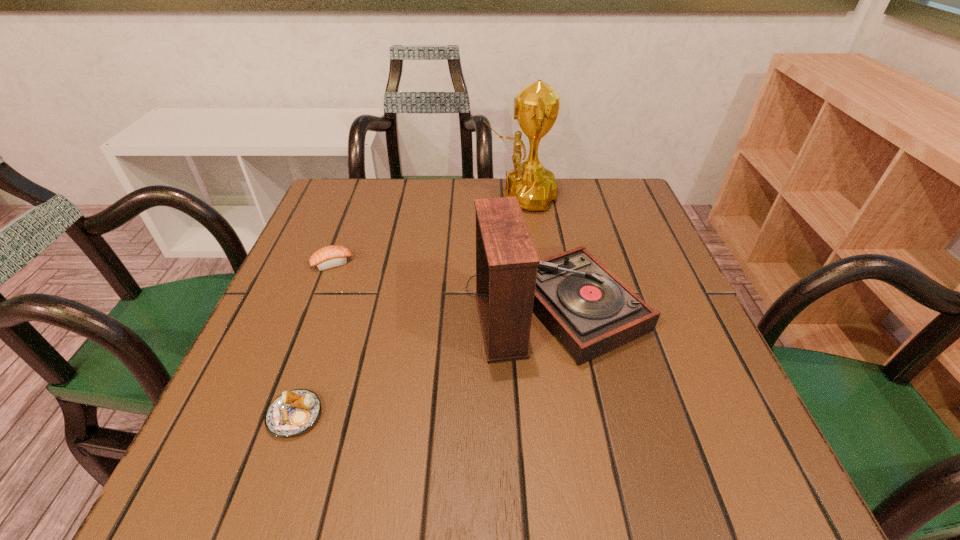
Locate an element on the screen. free area in between the farthest object and the second shortest object is located at coordinates (425, 230).

This screenshot has height=540, width=960. Find the location of `vacant space in between the phonograph record and the award`. vacant space in between the phonograph record and the award is located at coordinates (538, 253).

Find the location of a particular element. The height and width of the screenshot is (540, 960). free area in between the second shortest object and the second tallest object is located at coordinates (444, 286).

I want to click on free space between the second tallest object and the pastry, so click(425, 362).

Where is `free space that is in between the second tallest object and the farthest object`? free space that is in between the second tallest object and the farthest object is located at coordinates (538, 253).

Identify which object is the closest to the nearest object. Please provide its 2D coordinates. Your answer should be formatted as a tuple, i.e. [(x, y)], where the tuple contains the x and y coordinates of a point satisfying the conditions above.

[(590, 311)]

Find the location of a particular element. The width and height of the screenshot is (960, 540). object that can be found as the closest to the second tallest object is located at coordinates (536, 106).

Where is `vacant area that satisfies the following two spatial constraints: 1. on the front side of the second shortest object; 2. on the left side of the shortest object`? The image size is (960, 540). vacant area that satisfies the following two spatial constraints: 1. on the front side of the second shortest object; 2. on the left side of the shortest object is located at coordinates pyautogui.click(x=274, y=415).

At what (x,y) coordinates should I click in order to perform the action: click on free space that satisfies the following two spatial constraints: 1. on the back side of the phonograph record; 2. on the front side of the award. Please return your answer as a coordinate pair (x, y). This screenshot has width=960, height=540. Looking at the image, I should click on (536, 197).

Locate an element on the screen. free space that satisfies the following two spatial constraints: 1. on the front side of the phonograph record; 2. on the right side of the award is located at coordinates (534, 309).